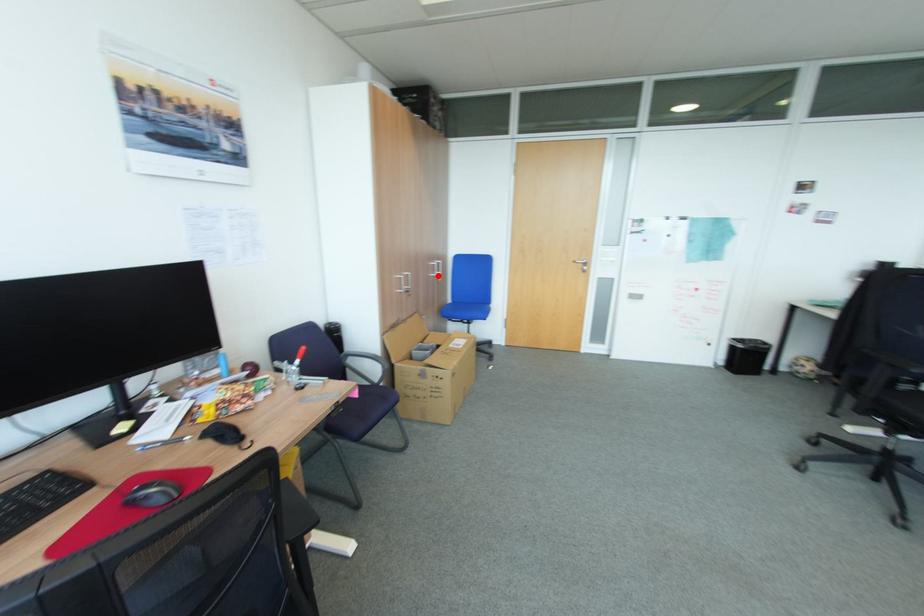
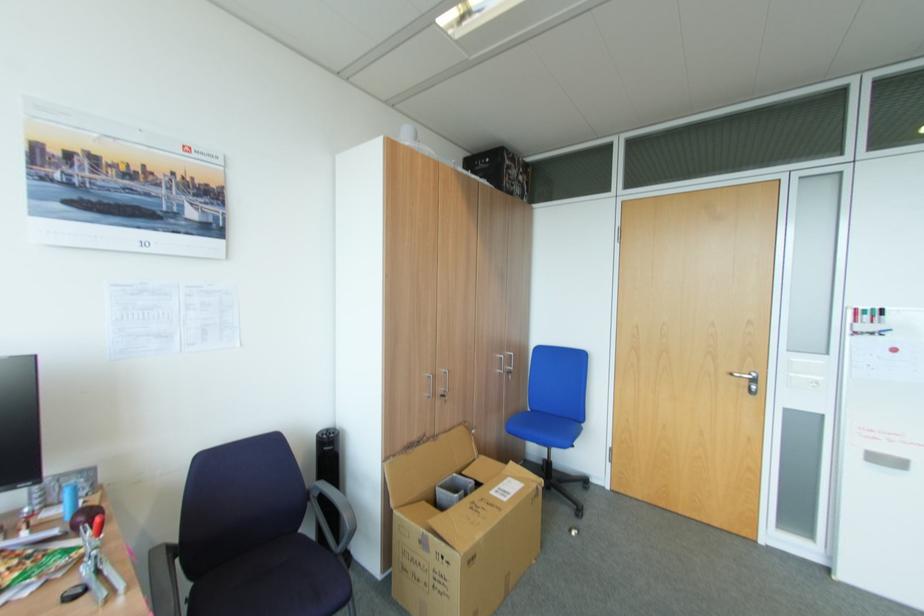
Question: I am providing you with two images of the same scene from different viewpoints. Given a red point in image1, look at the same physical point in image2. Is it:

Choices:
 (A) Closer to the viewpoint
 (B) Farther from the viewpoint

Answer: (B)